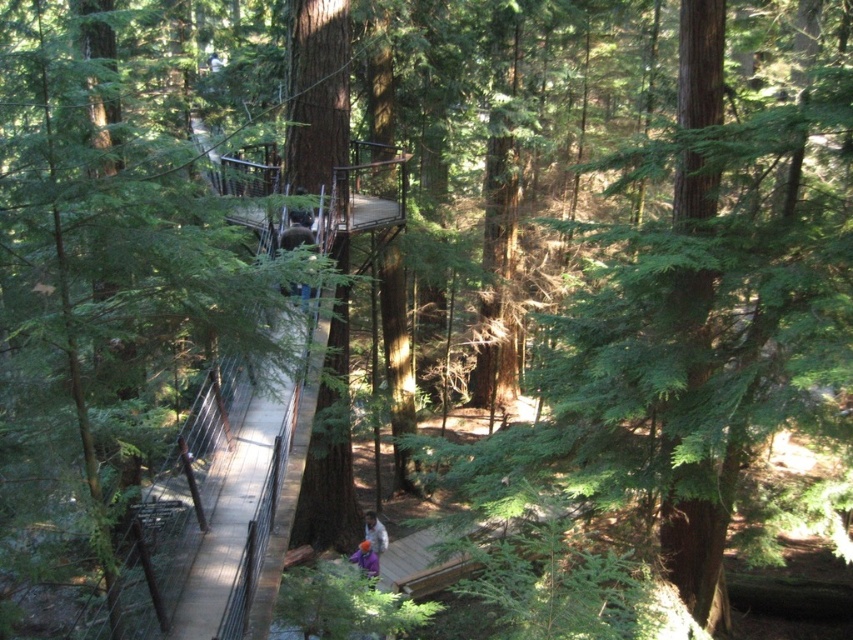
Question: Observing the image, what is the correct spatial positioning of white cotton shirt at lower center in reference to purple fabric at center?

Choices:
 (A) left
 (B) right

Answer: (B)

Question: Among these objects, which one is nearest to the camera?

Choices:
 (A) purple fabric at center
 (B) white cotton shirt at lower center

Answer: (A)

Question: Is white cotton shirt at lower center further to the viewer compared to purple fabric at center?

Choices:
 (A) yes
 (B) no

Answer: (A)

Question: Is white cotton shirt at lower center wider than purple fabric at center?

Choices:
 (A) no
 (B) yes

Answer: (A)